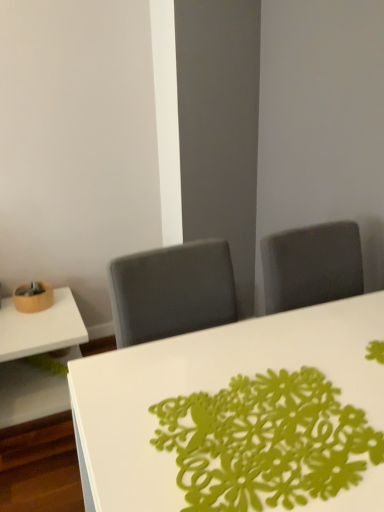
Locate an element on the screen. The height and width of the screenshot is (512, 384). empty space that is ontop of white glossy table at lower left, the first table positioned from the left (from a real-world perspective) is located at coordinates (32, 322).